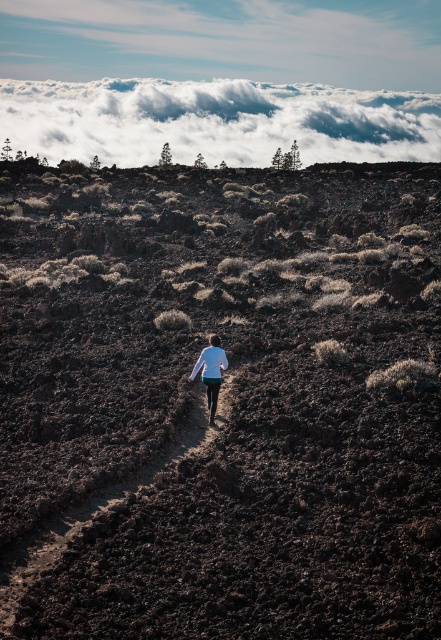
You are an astronaut on Mars and see the white fluffy cloud at upper center and the white matte shirt at center. Which object is larger in size?

The white fluffy cloud at upper center is bigger than the white matte shirt at center.

You are a hiker navigating the volcanic terrain and want to reach the point marked as point (208, 360). You notice another point, point (11, 509), along your path. Which point should you reach first according to their positions?

You should reach point (11, 509) first because it is in front of point (208, 360) along your path.